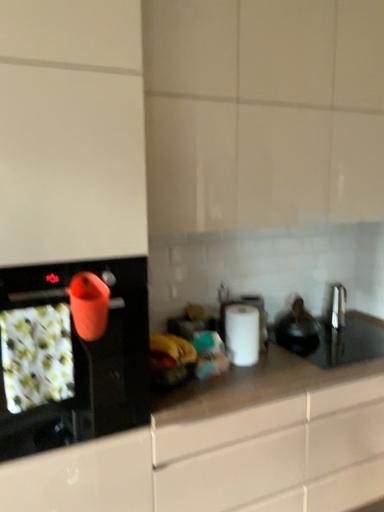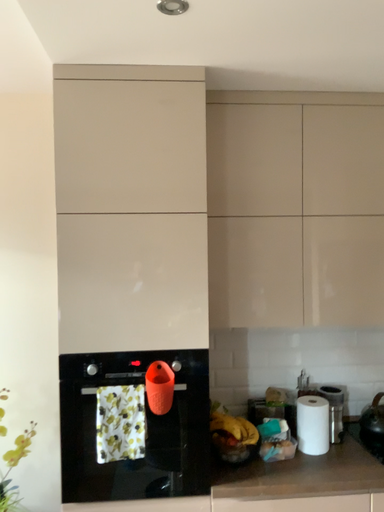
Question: Which way did the camera rotate in the video?

Choices:
 (A) rotated right
 (B) rotated left

Answer: (B)